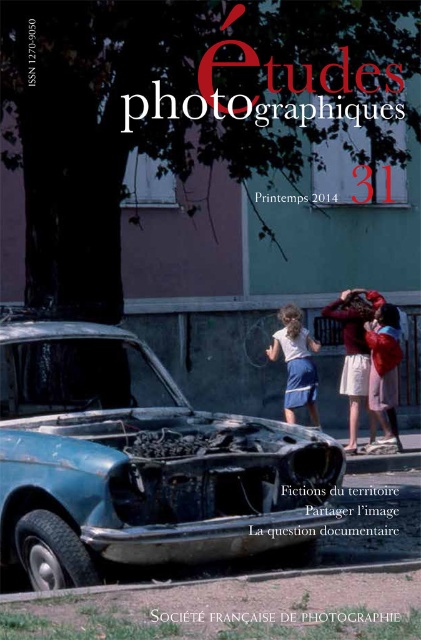
You are looking at the cover of the publication and notice two points marked on the image. Which point, point (357, 310) or point (295, 380), is closer to you?

Point (357, 310) is closer to the viewer than point (295, 380).

Looking at the cover of the publication, you notice the blue metallic car at lower left and the matte white shirt at center. Which object takes up more space in the image?

The blue metallic car at lower left is bigger than the matte white shirt at center, so it takes up more space in the image.

You are an observer looking at the cover of the publication. You notice two children wearing a matte red jacket at center and a matte white shirt at center. Which child is positioned to the right side?

The matte red jacket at center is to the right of the matte white shirt at center.